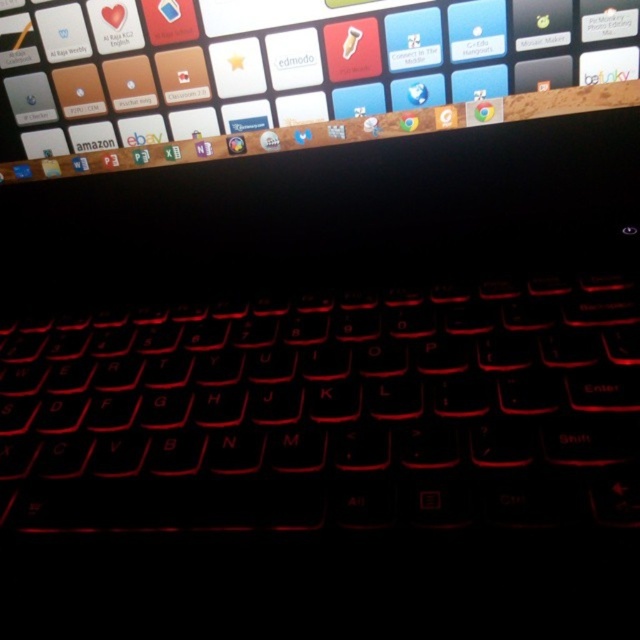
You are looking at the laptop screen and keyboard. There are two points marked on the image at coordinates point (250, 401) and point (16, 38). Which point is nearer to you?

Point (250, 401) is closer to the viewer than point (16, 38).

You are setting up a laptop for a presentation. You need to place a small decorative item on the part of the laptop that is taller between the black matte keyboard at center and the glossy plastic screen at upper center. Which part should you choose?

The black matte keyboard at center is taller than the glossy plastic screen at upper center, so you should place the decorative item on the black matte keyboard at center.